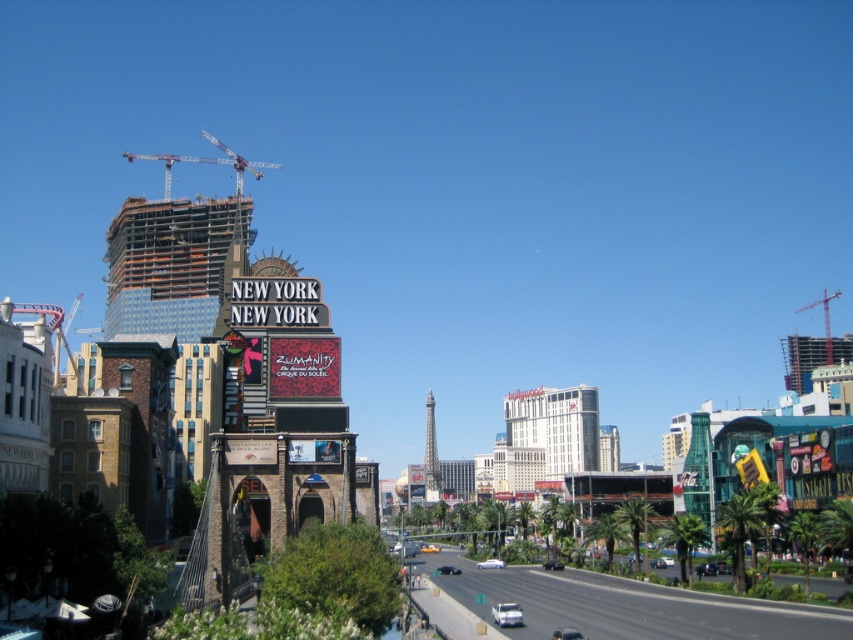
You are a construction inspector who needs to access both the concrete construction site at lower center and the metallic red crane at upper right. Which object is closer to the left side of the image?

The concrete construction site at lower center is positioned on the left side of the metallic red crane at upper right, so it is closer to the left side of the image.

You are standing at the base of the Eiffel Tower replica in the image and want to take a photo that includes both the New York New York sign and the Eiffel Tower. You notice two points marked on your camera screen at coordinates point (848, 620) and point (828, 353). Which point should you focus on to ensure both landmarks are in clear view?

You should focus on point (848, 620) because it is closer to the camera than point (828, 353), allowing both the New York New York sign and the Eiffel Tower to be in clear view.

You are a city planner reviewing the city layout. You notice the concrete construction site at lower center and the metallic construction crane at upper left. Which of these two occupies a smaller area in the image?

The concrete construction site at lower center occupies less space than the metallic construction crane at upper left, so it is the smaller one in terms of area.